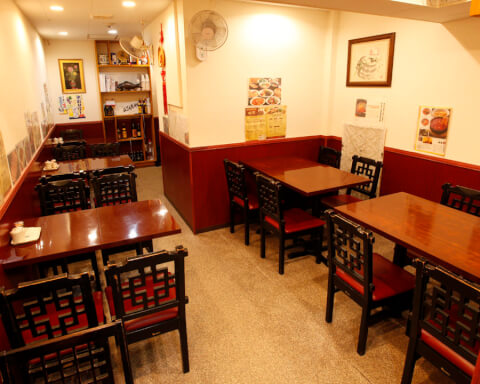
At what (x,y) coordinates should I click in order to perform the action: click on white wall. Please return your answer as a coordinate pair (x, y). Image resolution: width=480 pixels, height=384 pixels. Looking at the image, I should click on (424, 79).